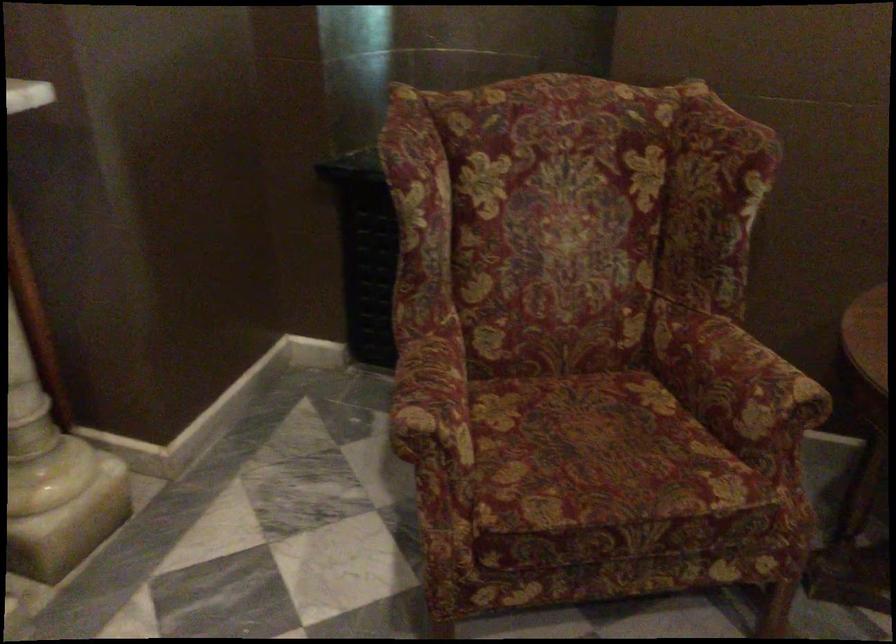
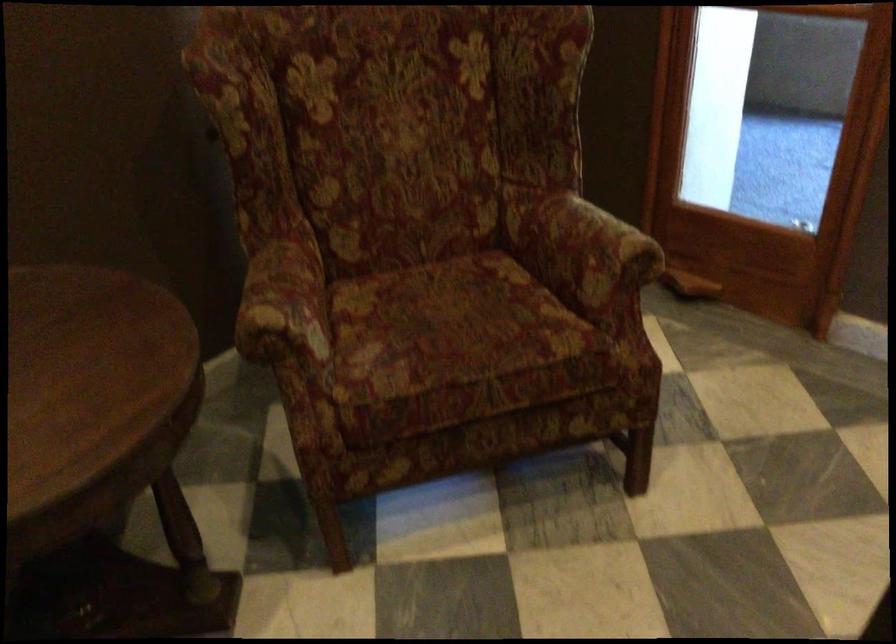
The images are taken continuously from a first-person perspective. In which direction is your viewpoint rotating?

The camera rotated toward right-down.